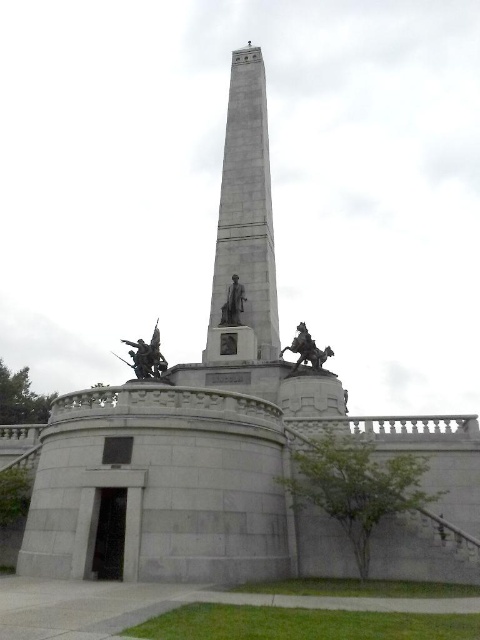
Who is more distant from viewer, (x=295, y=346) or (x=238, y=304)?

Positioned behind is point (x=238, y=304).

Between polished bronze horse at right and polished bronze statue at center, which one is positioned higher?

polished bronze statue at center is above.

Measure the distance between polished bronze horse at right and camera.

polished bronze horse at right and camera are 51.22 meters apart.

At what (x,y) coordinates should I click in order to perform the action: click on polished bronze horse at right. Please return your answer as a coordinate pair (x, y). The image size is (480, 640). Looking at the image, I should click on [x=307, y=349].

Based on the photo, between gray stone obelisk at center and bronze statue at center, which one appears on the right side from the viewer's perspective?

gray stone obelisk at center

Is gray stone obelisk at center smaller than bronze statue at center?

Incorrect, gray stone obelisk at center is not smaller in size than bronze statue at center.

Does point (229, 100) come farther from viewer compared to point (147, 369)?

Yes, point (229, 100) is behind point (147, 369).

Locate an element on the screen. The image size is (480, 640). gray stone obelisk at center is located at coordinates (248, 202).

Who is higher up, bronze statue at center or polished bronze statue at center?

polished bronze statue at center is above.

Can you confirm if bronze statue at center is thinner than polished bronze statue at center?

Incorrect, bronze statue at center's width is not less than polished bronze statue at center's.

Describe the element at coordinates (146, 356) in the screenshot. I see `bronze statue at center` at that location.

Where is `bronze statue at center`? The height and width of the screenshot is (640, 480). bronze statue at center is located at coordinates (146, 356).